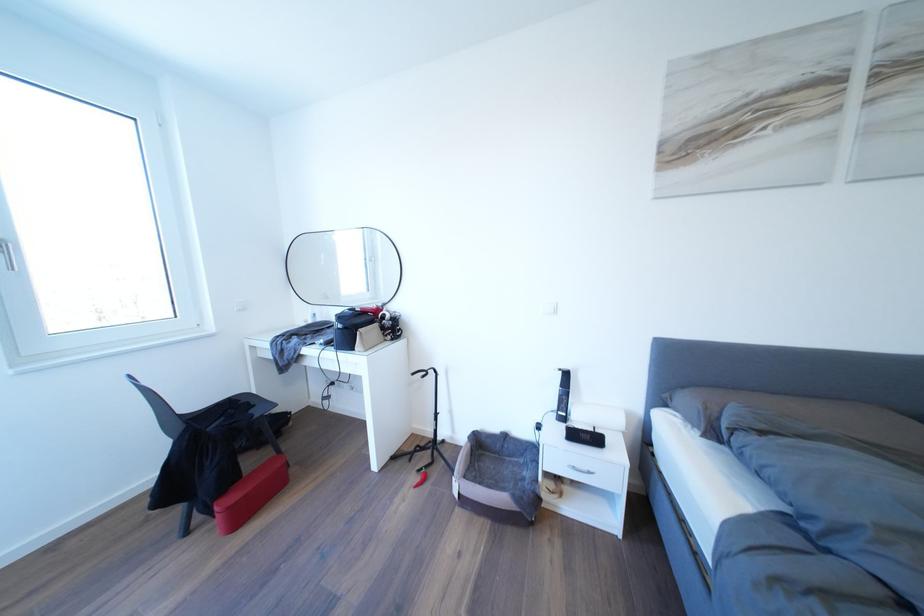
Image resolution: width=924 pixels, height=616 pixels. What do you see at coordinates (6, 254) in the screenshot?
I see `the white window handle` at bounding box center [6, 254].